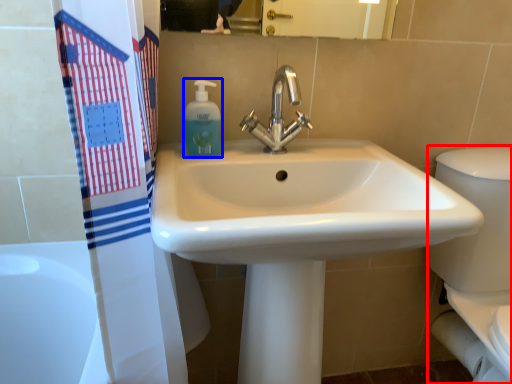
Question: Which of the following is the closest to the observer, porcelain (highlighted by a red box) or soap dispenser (highlighted by a blue box)?

Choices:
 (A) porcelain
 (B) soap dispenser

Answer: (A)